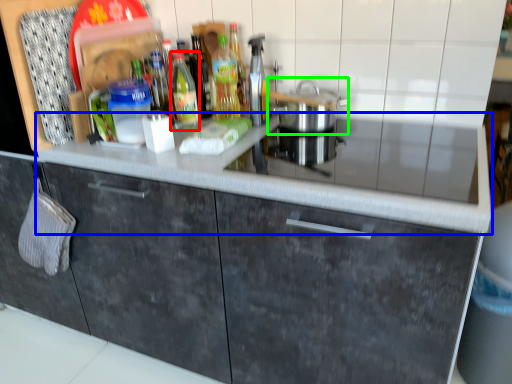
Question: Which object is positioned closest to bottle (highlighted by a red box)? Select from countertop (highlighted by a blue box) and home appliance (highlighted by a green box).

Choices:
 (A) countertop
 (B) home appliance

Answer: (B)